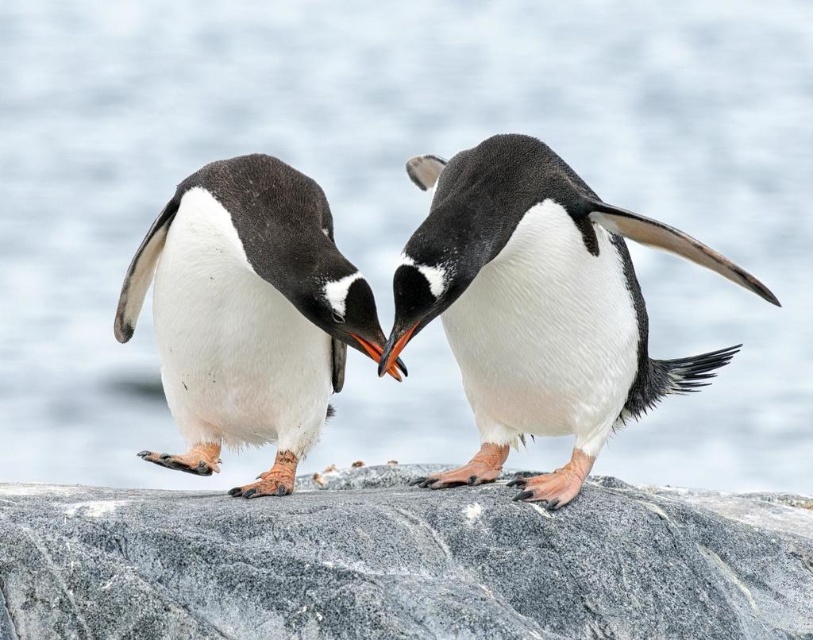
You are a photographer trying to capture a clear shot of the white matte penguin at center. The granite rock at center is blocking part of the penguin. Can you determine if the rock is taller or shorter than the penguin to adjust your camera angle?

The granite rock at center is shorter than the white matte penguin at center, so the rock is not taller than the penguin. Adjust your camera angle to position the shorter rock below the penguin for a clear shot.